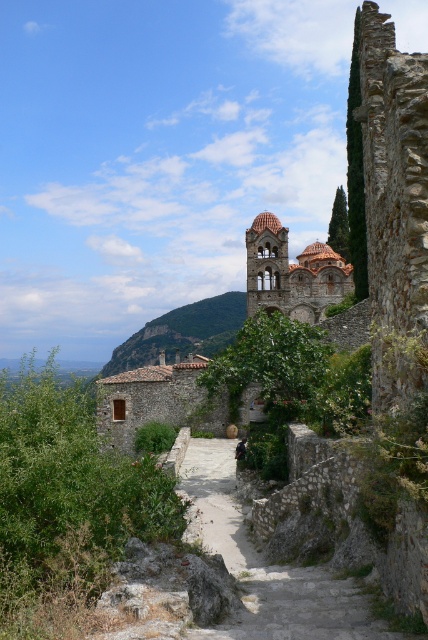
Is brown stone tower at center smaller than green stone wall at center?

Correct, brown stone tower at center occupies less space than green stone wall at center.

Which is in front, point (250, 236) or point (140, 346)?

Point (250, 236) is in front.

Locate an element on the screen. The width and height of the screenshot is (428, 640). brown stone tower at center is located at coordinates (291, 273).

Which of these two, stone steps at center or brown stone tower at center, stands taller?

brown stone tower at center

Locate an element on the screen. The image size is (428, 640). stone steps at center is located at coordinates (267, 566).

Measure the distance between stone steps at center and camera.

stone steps at center is 32.01 meters from camera.

The image size is (428, 640). I want to click on stone steps at center, so click(267, 566).

Does stone steps at center appear on the left side of green stone wall at center?

In fact, stone steps at center is to the right of green stone wall at center.

Is point (244, 534) positioned in front of point (118, 371)?

Yes, point (244, 534) is in front of point (118, 371).

The height and width of the screenshot is (640, 428). I want to click on stone steps at center, so click(x=267, y=566).